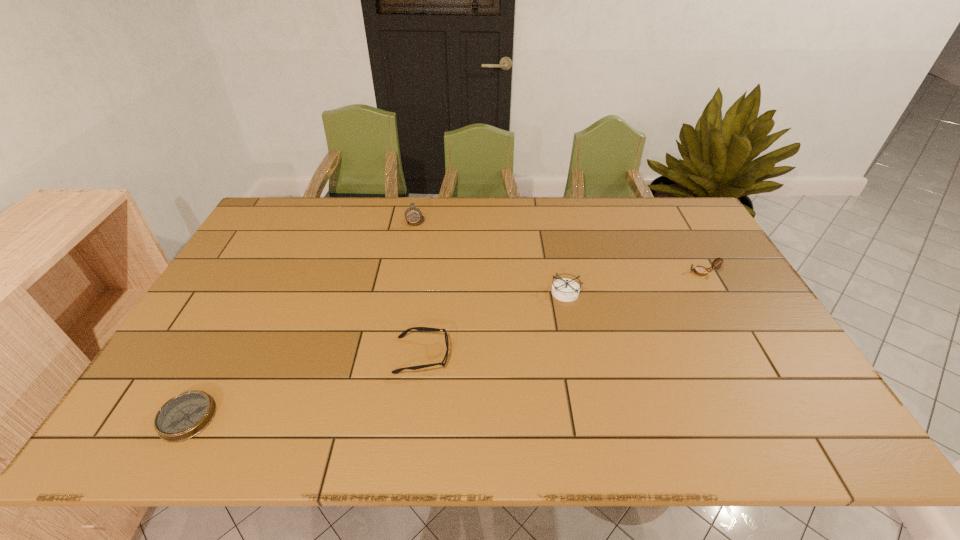
Find the location of `vacant area between the spectacles and the third nearest object`. vacant area between the spectacles and the third nearest object is located at coordinates (494, 323).

Locate an element on the screen. The image size is (960, 540). vacant space in between the tallest compass and the third nearest compass is located at coordinates (560, 246).

I want to click on blank region between the second farthest compass and the tallest object, so tap(560, 246).

Identify the location of vacant region between the leftmost object and the second compass from left to right. The width and height of the screenshot is (960, 540). 301,319.

Locate an element on the screen. The width and height of the screenshot is (960, 540). vacant space that's between the shortest compass and the fourth nearest object is located at coordinates (445, 345).

The width and height of the screenshot is (960, 540). Find the location of `free space between the fourth farthest object and the nearest compass`. free space between the fourth farthest object and the nearest compass is located at coordinates (304, 386).

The height and width of the screenshot is (540, 960). I want to click on object identified as the third closest to the second nearest compass, so click(414, 217).

Identify which object is the third nearest to the third compass from left to right. Please provide its 2D coordinates. Your answer should be formatted as a tuple, i.e. [(x, y)], where the tuple contains the x and y coordinates of a point satisfying the conditions above.

[(414, 217)]

Find the location of a particular element. The height and width of the screenshot is (540, 960). compass that is the third closest to the tallest compass is located at coordinates (700, 270).

What are the coordinates of `compass that is the second closest one to the third nearest object` in the screenshot? It's located at (414, 217).